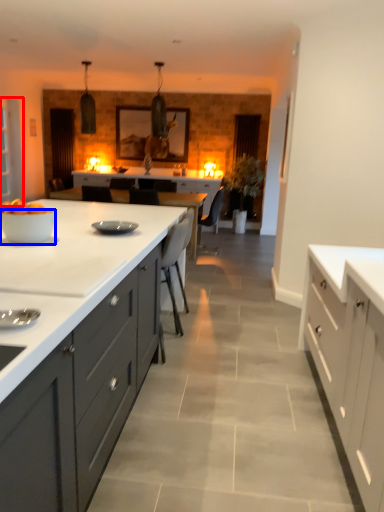
Question: Which of the following is the farthest to the observer, glass door (highlighted by a red box) or bowl (highlighted by a blue box)?

Choices:
 (A) glass door
 (B) bowl

Answer: (A)